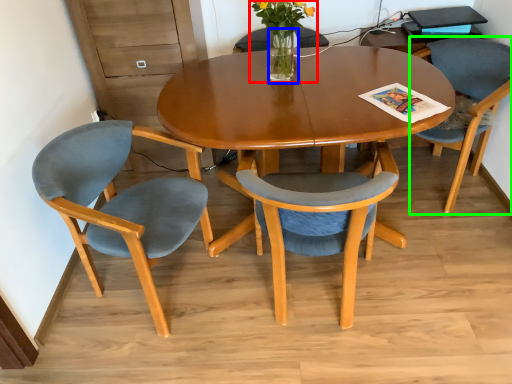
Question: Considering the real-world distances, which object is farthest from floral arrangement (highlighted by a red box)? vase (highlighted by a blue box) or chair (highlighted by a green box)?

Choices:
 (A) vase
 (B) chair

Answer: (B)